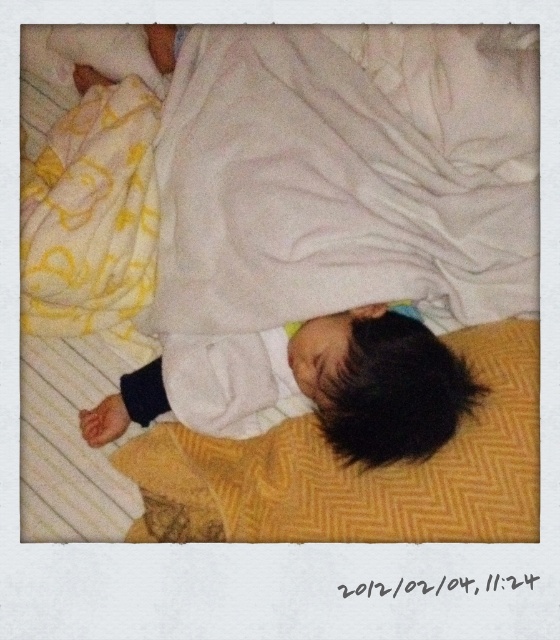
Between white soft blanket at upper center and white soft baby at center, which one appears on the right side from the viewer's perspective?

white soft blanket at upper center

Does white soft blanket at upper center appear on the left side of white soft baby at center?

No, white soft blanket at upper center is not to the left of white soft baby at center.

The height and width of the screenshot is (640, 560). I want to click on white soft blanket at upper center, so click(347, 172).